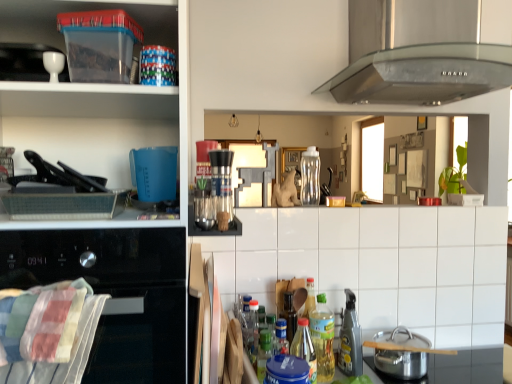
Describe the element at coordinates (350, 339) in the screenshot. This screenshot has width=512, height=384. I see `metallic spray bottle at lower center, the 1th appliance from the right` at that location.

What do you see at coordinates (323, 339) in the screenshot?
I see `translucent plastic bottle at lower center, which is the second bottle from back to front` at bounding box center [323, 339].

What is the approximate height of translucent plastic bottle at lower center, which appears as the second bottle when viewed from the front?

translucent plastic bottle at lower center, which appears as the second bottle when viewed from the front, is 11.10 inches tall.

This screenshot has width=512, height=384. I want to click on stainless steel pot at lower right, so click(401, 363).

The height and width of the screenshot is (384, 512). Describe the element at coordinates (93, 93) in the screenshot. I see `transparent plastic container at upper left, which ranks as the first shelf in left-to-right order` at that location.

You are a GUI agent. You are given a task and a screenshot of the screen. Output one action in this format:
    pyautogui.click(x=<x>, y=<y>)
    Task: Click on the metallic spray bottle at lower center, which is counted as the second appliance, starting from the top
    The width and height of the screenshot is (512, 384).
    Given the screenshot: What is the action you would take?
    pyautogui.click(x=350, y=339)

Can you confirm if plaid fabric towel at lower left is shorter than white glossy cup at upper left, placed as the 2th appliance when sorted from right to left?

No, plaid fabric towel at lower left is not shorter than white glossy cup at upper left, placed as the 2th appliance when sorted from right to left.

This screenshot has width=512, height=384. What are the coordinates of `material below the white glossy cup at upper left, acting as the 2th appliance starting from the bottom (from a real-world perspective)` in the screenshot? It's located at (48, 333).

Which is more to the right, plaid fabric towel at lower left or white glossy cup at upper left, the first appliance viewed from the left?

From the viewer's perspective, plaid fabric towel at lower left appears more on the right side.

Is plaid fabric towel at lower left positioned with its back to white glossy cup at upper left, acting as the 2th appliance starting from the bottom?

plaid fabric towel at lower left does not have its back to white glossy cup at upper left, acting as the 2th appliance starting from the bottom.

Choose the correct answer: Is white glossy cup at upper left, the first appliance from the front, inside transparent plastic container at upper left, acting as the second shelf starting from the left, or outside it?

white glossy cup at upper left, the first appliance from the front, is located beyond the bounds of transparent plastic container at upper left, acting as the second shelf starting from the left.

Considering the relative sizes of white glossy cup at upper left, the first appliance viewed from the left, and transparent plastic container at upper left, the second shelf positioned from the right, in the image provided, is white glossy cup at upper left, the first appliance viewed from the left, wider than transparent plastic container at upper left, the second shelf positioned from the right,?

In fact, white glossy cup at upper left, the first appliance viewed from the left, might be narrower than transparent plastic container at upper left, the second shelf positioned from the right.

From the image's perspective, is white glossy cup at upper left, placed as the 2th appliance when sorted from right to left, on transparent plastic container at upper left, acting as the second shelf starting from the left?

Incorrect, from the image's perspective, white glossy cup at upper left, placed as the 2th appliance when sorted from right to left, is lower than transparent plastic container at upper left, acting as the second shelf starting from the left.

Is white glossy cup at upper left, which is the 2th appliance in back-to-front order, looking in the opposite direction of transparent plastic container at upper left, acting as the second shelf starting from the left?

white glossy cup at upper left, which is the 2th appliance in back-to-front order, does not have its back to transparent plastic container at upper left, acting as the second shelf starting from the left.

Which of these two, plaid fabric towel at lower left or transparent plastic container at upper left, which appears as the third shelf when viewed from the right, is wider?

transparent plastic container at upper left, which appears as the third shelf when viewed from the right.

From a real-world perspective, which object rests below the other?

plaid fabric towel at lower left, from a real-world perspective.

Looking at this image, considering their positions, is plaid fabric towel at lower left located in front of or behind transparent plastic container at upper left, which appears as the third shelf when viewed from the right?

Visually, plaid fabric towel at lower left is located in front of transparent plastic container at upper left, which appears as the third shelf when viewed from the right.

Does white glossy cup at upper left, placed as the 2th appliance when sorted from right to left, contain black glass oven at left, the 2th home appliance when ordered from top to bottom?

Actually, black glass oven at left, the 2th home appliance when ordered from top to bottom, is outside white glossy cup at upper left, placed as the 2th appliance when sorted from right to left.

From a real-world perspective, is white glossy cup at upper left, placed as the 2th appliance when sorted from right to left, positioned over black glass oven at left, the 2th home appliance when ordered from top to bottom, based on gravity?

Yes.

How many degrees apart are the facing directions of white glossy cup at upper left, acting as the 1th appliance starting from the top, and black glass oven at left, the 2th home appliance positioned from the right?

The angular difference between white glossy cup at upper left, acting as the 1th appliance starting from the top, and black glass oven at left, the 2th home appliance positioned from the right, is 0.0304 degrees.

Is white glossy cup at upper left, acting as the 1th appliance starting from the top, positioned behind black glass oven at left, the first home appliance from the bottom?

Yes, the depth of white glossy cup at upper left, acting as the 1th appliance starting from the top, is greater than that of black glass oven at left, the first home appliance from the bottom.

From a real-world perspective, is stainless steel pot at lower right above or below translucent plastic bottle at lower center, which appears as the second bottle when viewed from the front?

stainless steel pot at lower right is below translucent plastic bottle at lower center, which appears as the second bottle when viewed from the front.

Looking at this image, is stainless steel pot at lower right positioned with its back to translucent plastic bottle at lower center, which is the second bottle from back to front?

That's not correct — stainless steel pot at lower right is not looking away from translucent plastic bottle at lower center, which is the second bottle from back to front.

Where is `counter below the translucent plastic bottle at lower center, placed as the second bottle when sorted from top to bottom (from the image's perspective)`? This screenshot has width=512, height=384. counter below the translucent plastic bottle at lower center, placed as the second bottle when sorted from top to bottom (from the image's perspective) is located at coordinates (453, 368).

What's the angular difference between stainless steel pot at lower right and translucent plastic bottle at lower center, which is the second bottle from back to front,'s facing directions?

They differ by 2.43 degrees in their facing directions.

Based on the photo, from the image's perspective, which one is positioned lower, transparent plastic container at upper left, the second shelf positioned from the right, or white glossy cup at upper left, the first appliance viewed from the left?

From the image's view, white glossy cup at upper left, the first appliance viewed from the left, is below.

Considering the positions of point (113, 3) and point (51, 75), is point (113, 3) closer or farther from the camera than point (51, 75)?

Clearly, point (113, 3) is closer to the camera than point (51, 75).

Who is more distant, transparent plastic container at upper left, acting as the second shelf starting from the left, or white glossy cup at upper left, which is the 2th appliance in back-to-front order?

white glossy cup at upper left, which is the 2th appliance in back-to-front order.

Locate an element on the screen. The height and width of the screenshot is (384, 512). the 1st appliance behind the transparent plastic container at upper left, acting as the second shelf starting from the left is located at coordinates (53, 64).

Is translucent plastic bottle at lower center, which is the second bottle from back to front, facing away from white tile at center, which is counted as the 3th shelf, starting from the left?

Yes.

Measure the distance between translucent plastic bottle at lower center, which is the second bottle from back to front, and white tile at center, which is counted as the 3th shelf, starting from the left.

The distance of translucent plastic bottle at lower center, which is the second bottle from back to front, from white tile at center, which is counted as the 3th shelf, starting from the left, is 12.91 inches.

From a real-world perspective, is translucent plastic bottle at lower center, placed as the second bottle when sorted from top to bottom, physically located above or below white tile at center, which is counted as the 3th shelf, starting from the left?

From a real-world perspective, translucent plastic bottle at lower center, placed as the second bottle when sorted from top to bottom, is physically below white tile at center, which is counted as the 3th shelf, starting from the left.

Visually, is translucent plastic bottle at lower center, placed as the second bottle when sorted from top to bottom, positioned to the left or to the right of white tile at center, which is counted as the 3th shelf, starting from the left?

In the image, translucent plastic bottle at lower center, placed as the second bottle when sorted from top to bottom, appears on the left side of white tile at center, which is counted as the 3th shelf, starting from the left.

Locate an element on the screen. appliance above the plaid fabric towel at lower left (from a real-world perspective) is located at coordinates 53,64.

The height and width of the screenshot is (384, 512). Identify the location of shelf that appears above the white glossy cup at upper left, placed as the 2th appliance when sorted from right to left (from the image's perspective). (85, 10).

Considering their positions, is plaid fabric towel at lower left positioned closer to stainless steel range hood at upper center, the 1th home appliance viewed from the right, than stainless steel pot at lower right?

Based on the image, stainless steel pot at lower right appears to be nearer to stainless steel range hood at upper center, the 1th home appliance viewed from the right.

Looking at the image, which one is located further to transparent plastic container at upper left, which ranks as the first shelf in left-to-right order, white tile at center, the first shelf positioned from the right, or translucent plastic bottle at lower center, acting as the second bottle starting from the bottom?

Based on the image, translucent plastic bottle at lower center, acting as the second bottle starting from the bottom, appears to be further to transparent plastic container at upper left, which ranks as the first shelf in left-to-right order.

Looking at the image, which one is located further to stainless steel range hood at upper center, marked as the second home appliance in a left-to-right arrangement, transparent plastic container at upper left, which ranks as the first shelf in left-to-right order, or white tile at center, the first shelf positioned from the right?

Among the two, transparent plastic container at upper left, which ranks as the first shelf in left-to-right order, is located further to stainless steel range hood at upper center, marked as the second home appliance in a left-to-right arrangement.

Which object lies further to the anchor point stainless steel pot at lower right, translucent plastic bottle at center, which is the 3th bottle in back-to-front order, or metallic spray bottle at lower center, the first appliance in the bottom-to-top sequence?

translucent plastic bottle at center, which is the 3th bottle in back-to-front order, lies further to stainless steel pot at lower right than the other object.

Estimate the real-world distances between objects in this image. Which object is closer to translucent plastic bottle at center, which ranks as the first bottle in front-to-back order, stainless steel pot at lower right or metallic spray bottle at lower center, which is counted as the second appliance, starting from the top?

metallic spray bottle at lower center, which is counted as the second appliance, starting from the top, is positioned closer to the anchor translucent plastic bottle at center, which ranks as the first bottle in front-to-back order.

When comparing their distances from transparent plastic container at upper left, the second shelf positioned from the right, does metallic spray bottle at lower center, the 2th appliance when ordered from left to right, or stainless steel range hood at upper center, which ranks as the 2th home appliance in bottom-to-top order, seem closer?

The object closer to transparent plastic container at upper left, the second shelf positioned from the right, is stainless steel range hood at upper center, which ranks as the 2th home appliance in bottom-to-top order.

Estimate the real-world distances between objects in this image. Which object is closer to translucent plastic bottle at lower center, which appears as the second bottle when viewed from the front, white tile at center, which is counted as the 3th shelf, starting from the left, or translucent plastic bottle at center, the 3th bottle from the top?

translucent plastic bottle at center, the 3th bottle from the top, is positioned closer to the anchor translucent plastic bottle at lower center, which appears as the second bottle when viewed from the front.

Consider the image. When comparing their distances from white glossy cup at upper left, the first appliance viewed from the left, does black glass oven at left, the 2th home appliance positioned from the right, or stainless steel pot at lower right seem further?

stainless steel pot at lower right is positioned further to the anchor white glossy cup at upper left, the first appliance viewed from the left.

You are a GUI agent. You are given a task and a screenshot of the screen. Output one action in this format:
    pyautogui.click(x=<x>, y=<y>)
    Task: Click on the material between black glass oven at left, the first home appliance from the bottom, and translucent plastic bottle at center, which is the 3th bottle in back-to-front order, in the horizontal direction
    
    Given the screenshot: What is the action you would take?
    pyautogui.click(x=48, y=333)

Identify the location of material between transparent plastic container at upper left, the second shelf positioned from the right, and translucent plastic bottle at center, which ranks as the first bottle in front-to-back order, in the vertical direction. Image resolution: width=512 pixels, height=384 pixels. (48, 333).

I want to click on kitchen appliance located between translucent plastic bottle at lower center, placed as the second bottle when sorted from top to bottom, and stainless steel pot at lower right in the left-right direction, so click(x=401, y=363).

I want to click on appliance between translucent plastic bottle at center, which ranks as the first bottle in front-to-back order, and stainless steel pot at lower right, in the horizontal direction, so click(x=350, y=339).